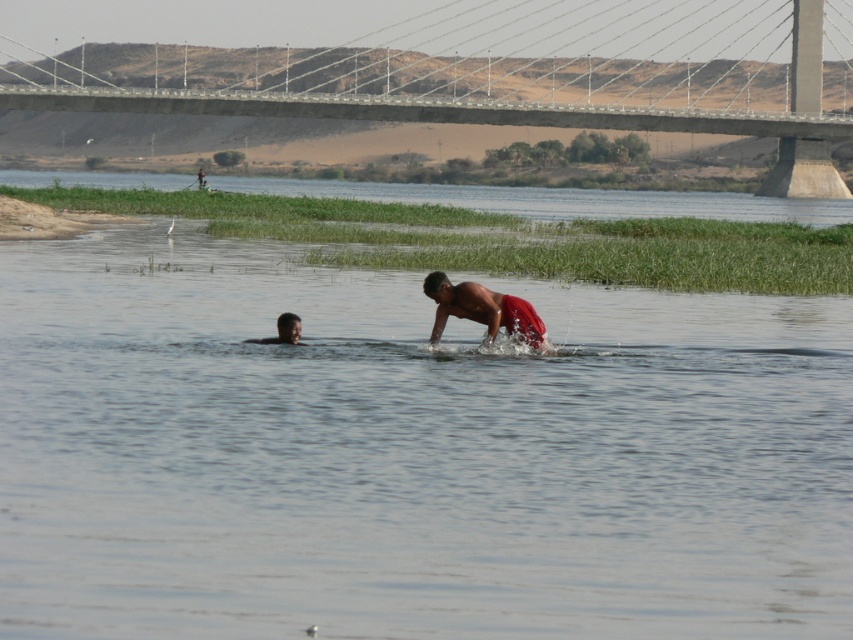
You are a photographer standing on the suspension bridge. You want to take a photo of the clear water at center and the clear water at river center. Which one will appear closer to the camera in the photo?

The clear water at center will appear closer to the camera in the photo because it is positioned in front of the clear water at river center.

You are standing at the edge of the river and want to take a photo of both point (457, 200) and point (538, 321) in the scene. Which point is closer to you so that you can focus on it first?

Point (457, 200) is closer to you than point (538, 321), so you can focus on it first.